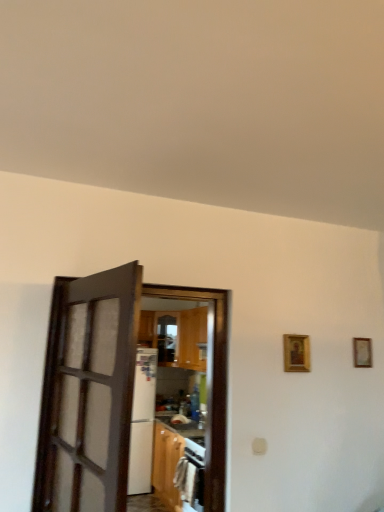
Question: From a real-world perspective, is gold-framed picture at right, the 2th picture frame from the left, above or below dark wood door at left, arranged as the 2th door when viewed from the back?

Choices:
 (A) above
 (B) below

Answer: (A)

Question: Is gold-framed picture at right, the 1th picture frame viewed from the back, bigger or smaller than dark wood door at left, the 1th door from the front?

Choices:
 (A) small
 (B) big

Answer: (A)

Question: Which of these objects is positioned farthest from the brown wooden door at center, the second door in the front-to-back sequence?

Choices:
 (A) gold-framed picture at right, the 1th picture frame viewed from the back
 (B) dark wood door at left, arranged as the 2th door when viewed from the back
 (C) gold-framed picture at upper right, which ranks as the first picture frame in front-to-back order

Answer: (A)

Question: Estimate the real-world distances between objects in this image. Which object is closer to the brown wooden door at center, the second door in the front-to-back sequence?

Choices:
 (A) gold-framed picture at right, which is the first picture frame in right-to-left order
 (B) dark wood door at left, arranged as the 2th door when viewed from the back
 (C) gold-framed picture at upper right, the first picture frame in the left-to-right sequence

Answer: (C)